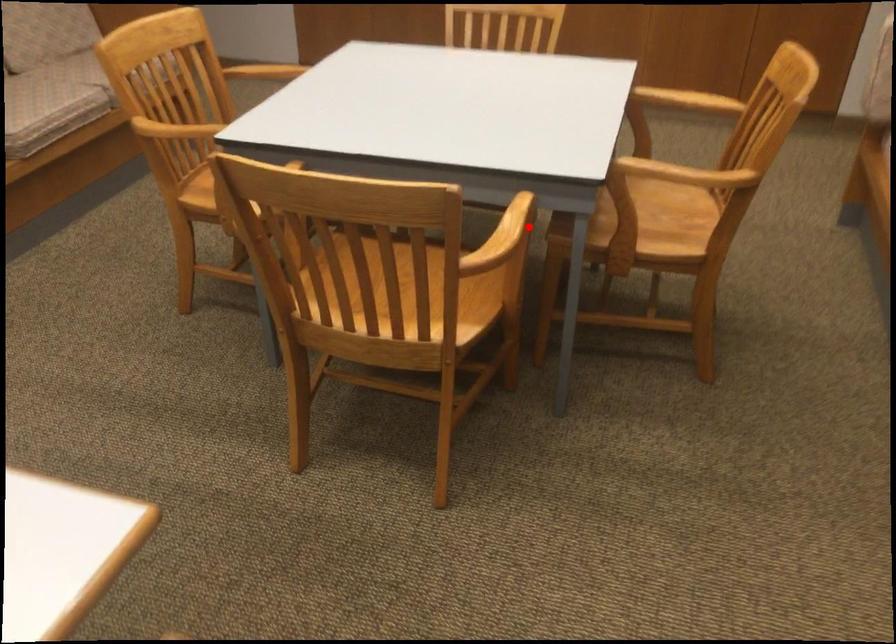
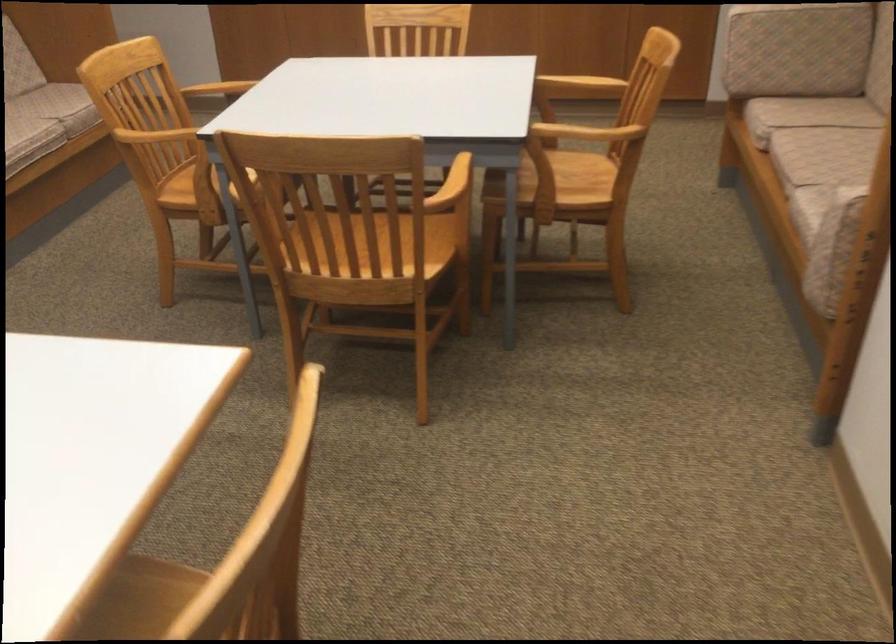
Question: I am providing you with two images of the same scene from different viewpoints. In image1, a red point is highlighted. Considering the same 3D point in image2, which of the following is correct?

Choices:
 (A) It is closer
 (B) It is farther

Answer: (B)